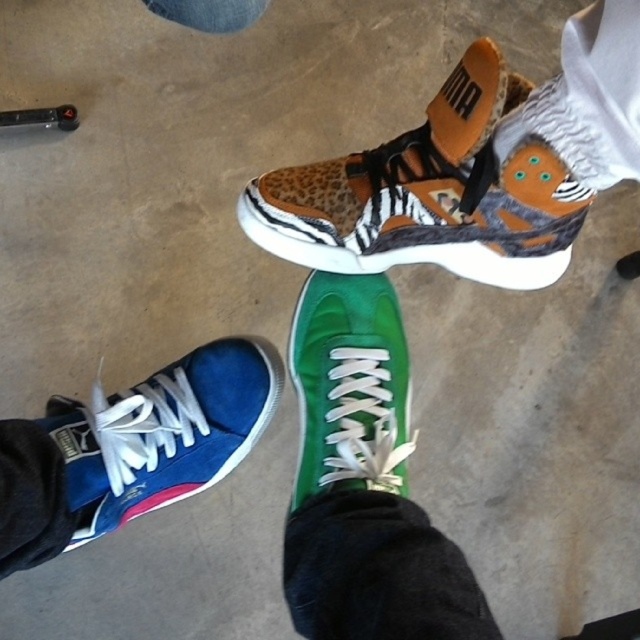
Question: Which object appears farthest from the camera in this image?

Choices:
 (A) green suede sneaker at center
 (B) leopard print fabric sneaker at upper center
 (C) blue suede sneaker at lower left

Answer: (C)

Question: Does leopard print fabric sneaker at upper center come behind green suede sneaker at center?

Choices:
 (A) yes
 (B) no

Answer: (B)

Question: Estimate the real-world distances between objects in this image. Which object is farther from the blue suede sneaker at lower left?

Choices:
 (A) leopard print fabric sneaker at upper center
 (B) green suede sneaker at center

Answer: (A)

Question: Which object is farther from the camera taking this photo?

Choices:
 (A) leopard print fabric sneaker at upper center
 (B) green suede sneaker at center

Answer: (B)

Question: Can you confirm if leopard print fabric sneaker at upper center is wider than blue suede sneaker at lower left?

Choices:
 (A) no
 (B) yes

Answer: (B)

Question: Does leopard print fabric sneaker at upper center appear over green suede sneaker at center?

Choices:
 (A) yes
 (B) no

Answer: (A)